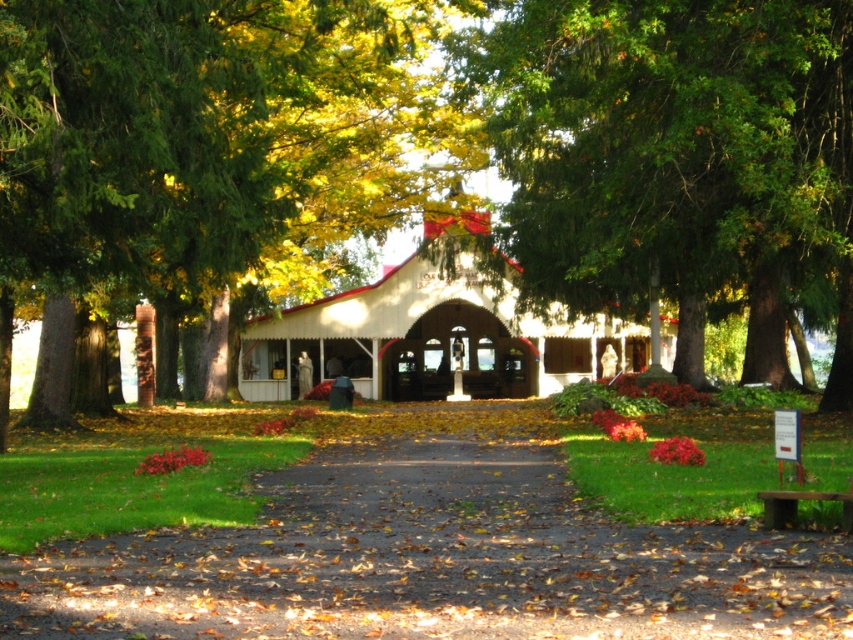
Question: Which point is farther from the camera taking this photo?

Choices:
 (A) (415, 589)
 (B) (645, 260)

Answer: (B)

Question: Does white wood chapel at center appear on the right side of wooden park bench at lower right?

Choices:
 (A) no
 (B) yes

Answer: (A)

Question: Among these objects, which one is nearest to the camera?

Choices:
 (A) wooden park bench at lower right
 (B) white wood chapel at center

Answer: (A)

Question: Which point is closer to the camera?

Choices:
 (A) green textured tree at center
 (B) wooden park bench at lower right
 (C) brown dirt path at center
 (D) white wood chapel at center

Answer: (C)

Question: Is green leafy tree at center positioned at the back of white wood chapel at center?

Choices:
 (A) no
 (B) yes

Answer: (A)

Question: Can you confirm if green leafy tree at center is positioned to the right of white wood chapel at center?

Choices:
 (A) no
 (B) yes

Answer: (A)